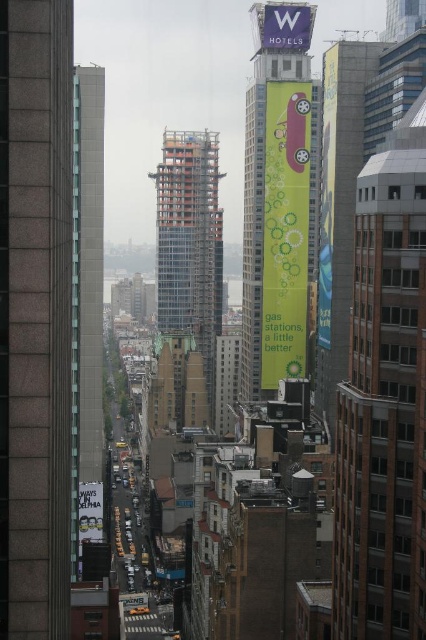
Question: Among these points, which one is nearest to the camera?

Choices:
 (A) (245, 241)
 (B) (216, 189)

Answer: (A)

Question: Considering the relative positions of glassy orange tower at center and white fabric sign at upper center in the image provided, where is glassy orange tower at center located with respect to white fabric sign at upper center?

Choices:
 (A) right
 (B) left

Answer: (B)

Question: In this image, where is green fabric banner at center located relative to white fabric sign at upper center?

Choices:
 (A) below
 (B) above

Answer: (A)

Question: Which point is closer to the camera?

Choices:
 (A) green fabric banner at center
 (B) white fabric sign at upper center
 (C) glassy orange tower at center

Answer: (A)

Question: Which point is closer to the camera?

Choices:
 (A) glassy orange tower at center
 (B) white fabric sign at upper center
 (C) gray concrete skyscraper at center
 (D) green fabric banner at center

Answer: (C)

Question: Does gray concrete skyscraper at center have a larger size compared to glassy orange tower at center?

Choices:
 (A) no
 (B) yes

Answer: (B)